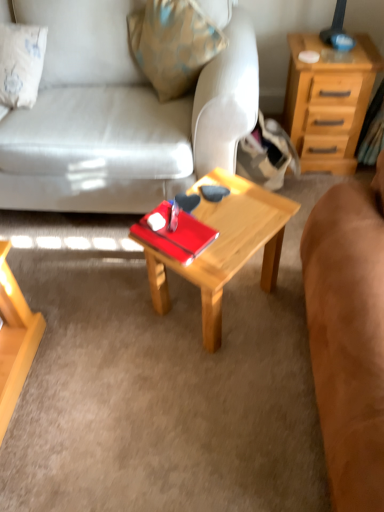
At what (x,y) coordinates should I click in order to perform the action: click on free space that is in between wooden coffee table at center and brown suede couch at center, which is the 2th studio couch in left-to-right order. Please return your answer as a coordinate pair (x, y). This screenshot has height=512, width=384. Looking at the image, I should click on (257, 381).